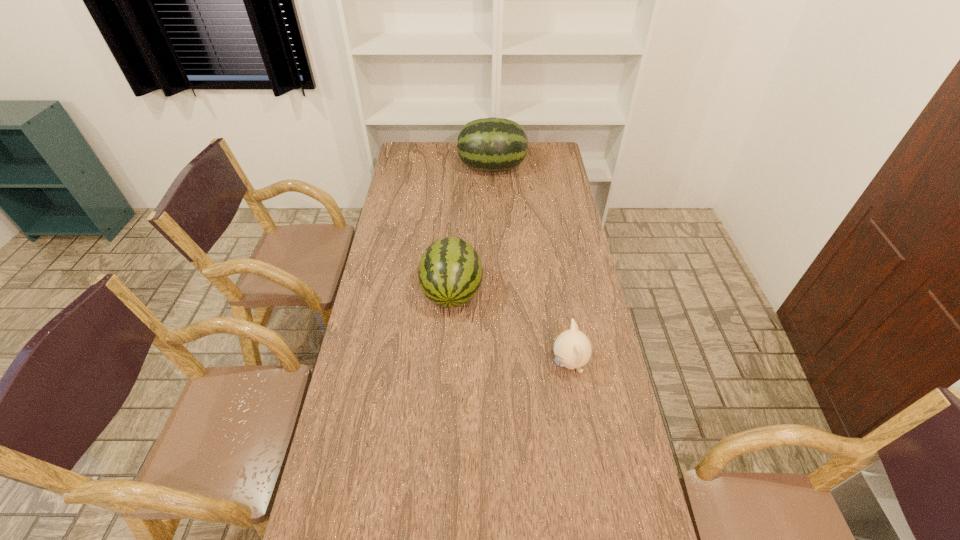
You are a GUI agent. You are given a task and a screenshot of the screen. Output one action in this format:
    pyautogui.click(x=<x>, y=<y>)
    Task: Click on the object present at the far edge
    This screenshot has width=960, height=540.
    Given the screenshot: What is the action you would take?
    pyautogui.click(x=491, y=144)

Locate an element on the screen. object that is at the right edge is located at coordinates (572, 348).

Identify the location of blank space at the left edge of the desktop. (365, 488).

Locate an element on the screen. This screenshot has height=540, width=960. vacant space at the right edge of the desktop is located at coordinates (578, 252).

Identify the location of vacant space at the far left corner of the desktop. This screenshot has height=540, width=960. (420, 145).

Locate an element on the screen. vacant region at the far right corner of the desktop is located at coordinates (529, 148).

Locate an element on the screen. This screenshot has height=540, width=960. vacant area between the shortest object and the farther watermelon is located at coordinates (531, 266).

Where is `free spot between the nearer watermelon and the shortest object`? The height and width of the screenshot is (540, 960). free spot between the nearer watermelon and the shortest object is located at coordinates click(x=511, y=328).

Identify the location of free area in between the nearer watermelon and the farther watermelon. (472, 230).

Where is `empty location between the farthest object and the second tallest object`? This screenshot has height=540, width=960. empty location between the farthest object and the second tallest object is located at coordinates (472, 230).